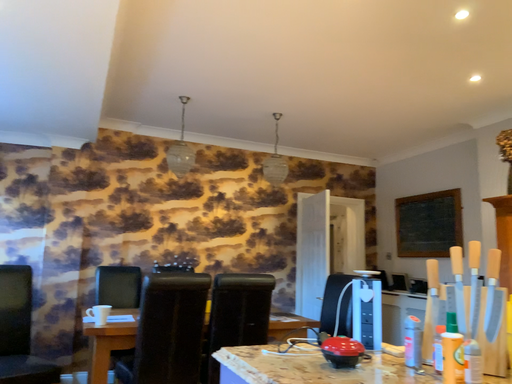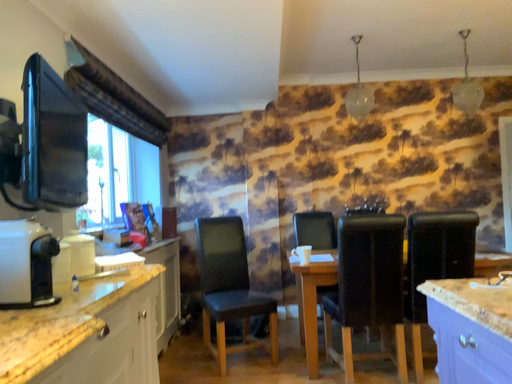
Question: How did the camera likely rotate when shooting the video?

Choices:
 (A) rotated right
 (B) rotated left

Answer: (B)